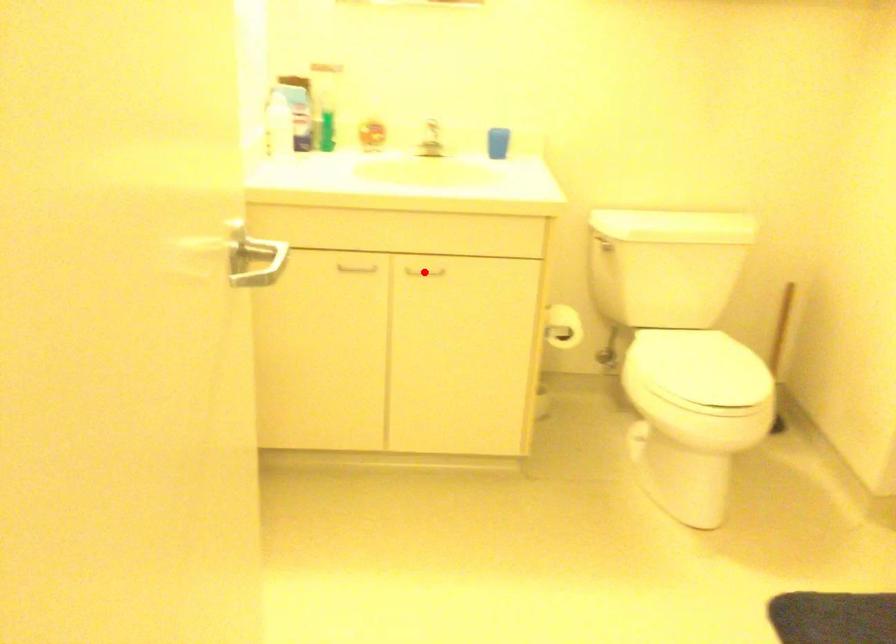
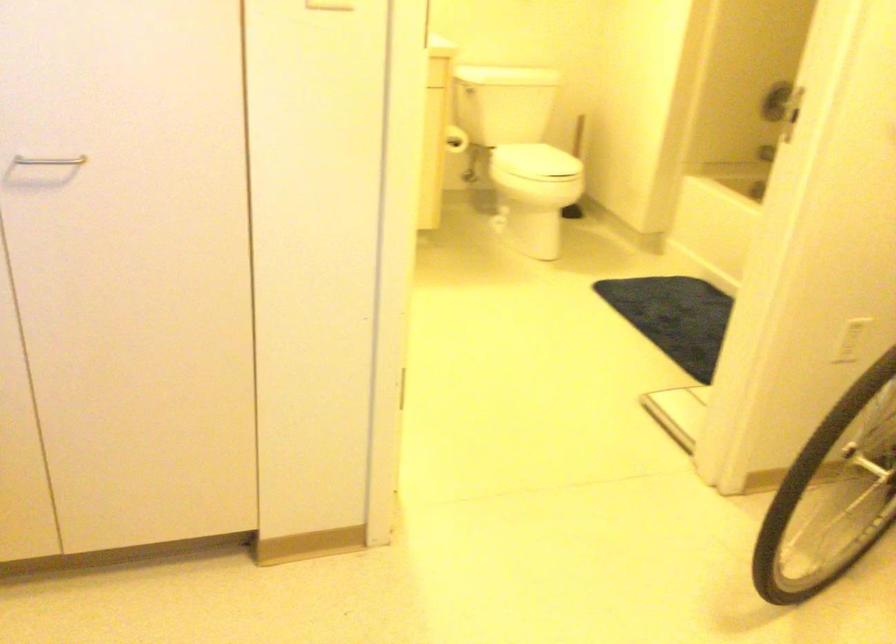
Question: I am providing you with two images of the same scene from different viewpoints. A red point is marked on the first image. Can you still see the location of the red point in image 2?

Choices:
 (A) Yes
 (B) No

Answer: (B)